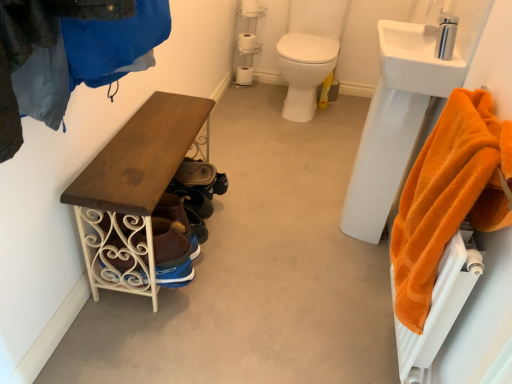
Question: Considering the relative sizes of silver metallic faucet at upper right and wooden bench at left in the image provided, is silver metallic faucet at upper right taller than wooden bench at left?

Choices:
 (A) no
 (B) yes

Answer: (B)

Question: From the image's perspective, is silver metallic faucet at upper right under wooden bench at left?

Choices:
 (A) no
 (B) yes

Answer: (A)

Question: Does silver metallic faucet at upper right lie behind wooden bench at left?

Choices:
 (A) no
 (B) yes

Answer: (B)

Question: Is silver metallic faucet at upper right in contact with wooden bench at left?

Choices:
 (A) no
 (B) yes

Answer: (A)

Question: Is silver metallic faucet at upper right turned away from wooden bench at left?

Choices:
 (A) yes
 (B) no

Answer: (B)

Question: Can you confirm if silver metallic faucet at upper right is wider than wooden bench at left?

Choices:
 (A) yes
 (B) no

Answer: (B)

Question: Considering the relative sizes of orange plush towel at right and wooden bench at left in the image provided, is orange plush towel at right taller than wooden bench at left?

Choices:
 (A) no
 (B) yes

Answer: (B)

Question: From the image's perspective, is orange plush towel at right over wooden bench at left?

Choices:
 (A) yes
 (B) no

Answer: (B)

Question: Does orange plush towel at right lie behind wooden bench at left?

Choices:
 (A) no
 (B) yes

Answer: (A)

Question: Is orange plush towel at right not near wooden bench at left?

Choices:
 (A) no
 (B) yes

Answer: (A)

Question: Can you confirm if orange plush towel at right is thinner than wooden bench at left?

Choices:
 (A) no
 (B) yes

Answer: (B)

Question: Are orange plush towel at right and wooden bench at left beside each other?

Choices:
 (A) yes
 (B) no

Answer: (B)

Question: Considering the relative positions of white ceramic sink at upper right and white glossy toilet at center in the image provided, is white ceramic sink at upper right to the left of white glossy toilet at center from the viewer's perspective?

Choices:
 (A) no
 (B) yes

Answer: (A)